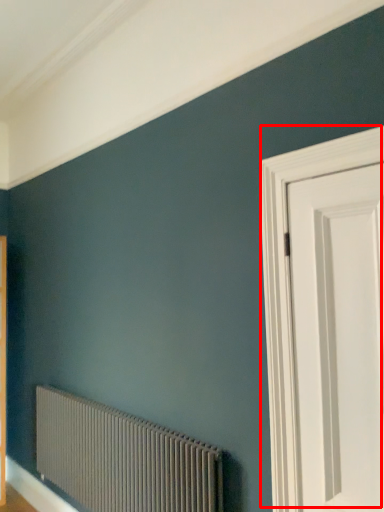
Question: In this image, where is door (annotated by the red box) located relative to radiator?

Choices:
 (A) left
 (B) right

Answer: (B)